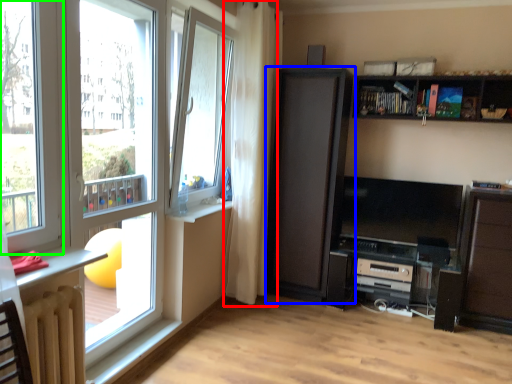
Question: Based on their relative distances, which object is nearer to curtain (highlighted by a red box)? Choose from cupboard (highlighted by a blue box) and window (highlighted by a green box).

Choices:
 (A) cupboard
 (B) window

Answer: (A)